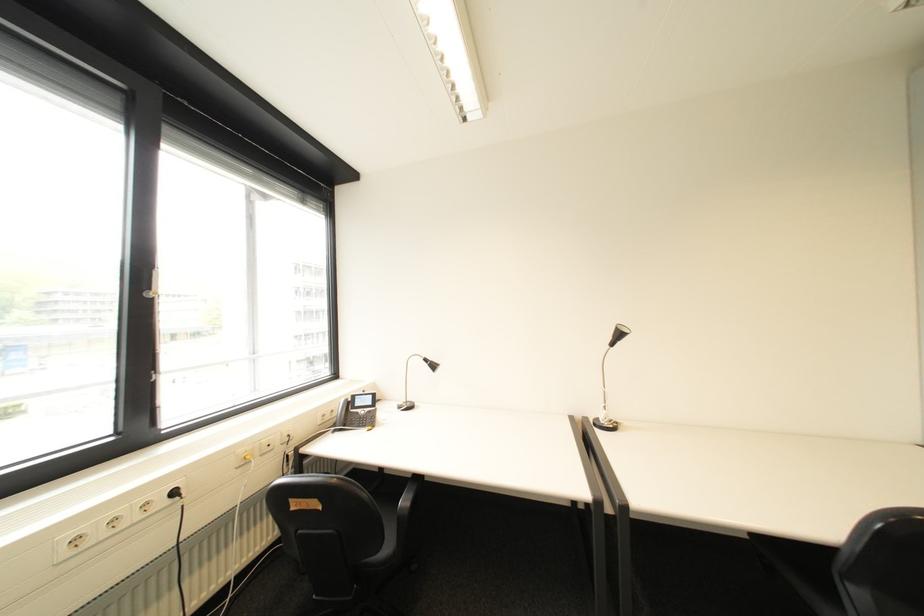
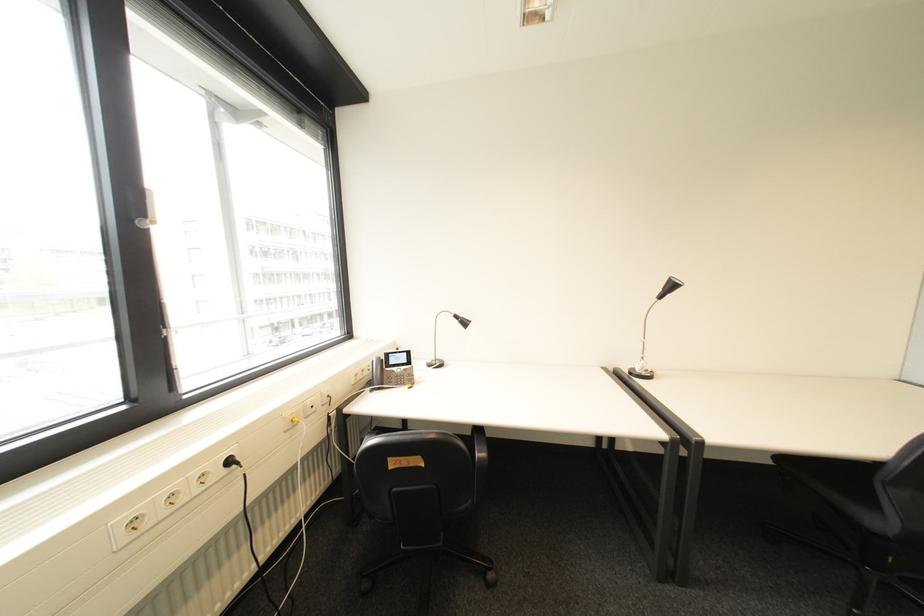
Find the pixel in the second image that matches point 623,338 in the first image.

(673, 290)